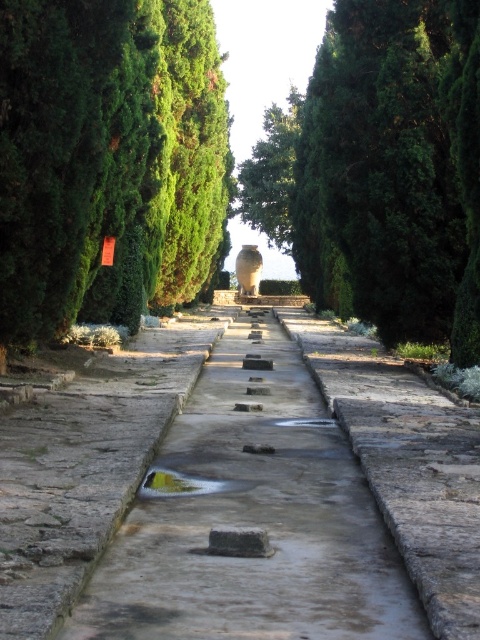
Is green leafy tree at left positioned before green textured stone at center?

Yes, green leafy tree at left is in front of green textured stone at center.

Is green leafy tree at left below green textured stone at center?

Correct, green leafy tree at left is located below green textured stone at center.

The height and width of the screenshot is (640, 480). What do you see at coordinates (108, 161) in the screenshot?
I see `green leafy tree at left` at bounding box center [108, 161].

This screenshot has height=640, width=480. I want to click on green leafy tree at left, so click(108, 161).

Between point (204, 394) and point (288, 129), which one is positioned behind?

The point (288, 129) is more distant.

Between gray stone steps at center and green leafy tree at center, which one has less height?

Standing shorter between the two is gray stone steps at center.

Locate an element on the screen. Image resolution: width=480 pixels, height=640 pixels. gray stone steps at center is located at coordinates (252, 518).

Where is `green textured stone at center`? This screenshot has width=480, height=640. green textured stone at center is located at coordinates (395, 170).

Is green textured stone at center to the left of green leafy tree at center from the viewer's perspective?

In fact, green textured stone at center is to the right of green leafy tree at center.

You are a GUI agent. You are given a task and a screenshot of the screen. Output one action in this format:
    pyautogui.click(x=<x>, y=<y>)
    Task: Click on the green textured stone at center
    This screenshot has height=640, width=480.
    Given the screenshot: What is the action you would take?
    pyautogui.click(x=395, y=170)

The width and height of the screenshot is (480, 640). What are the coordinates of `green textured stone at center` in the screenshot? It's located at (395, 170).